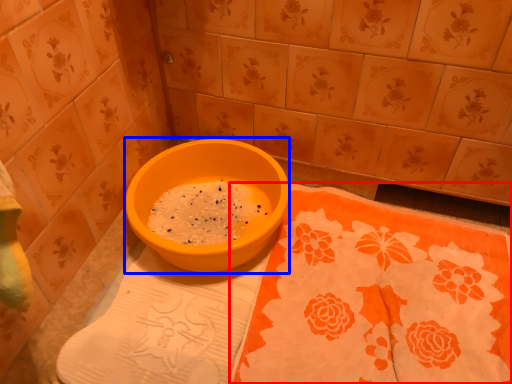
Question: Among these objects, which one is nearest to the camera, tablecloth (highlighted by a red box) or basin (highlighted by a blue box)?

Choices:
 (A) tablecloth
 (B) basin

Answer: (A)